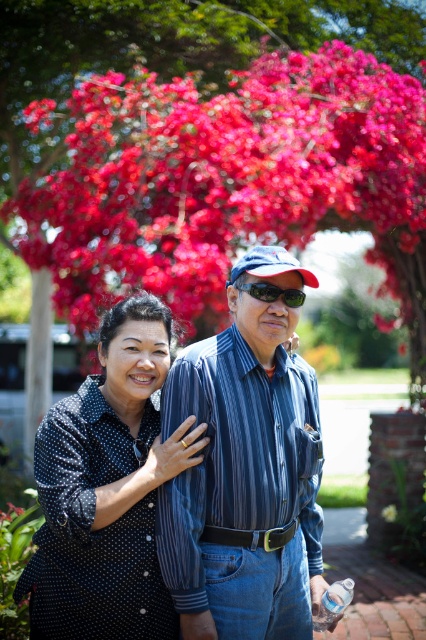
Based on the photo, you are standing in a garden and see the vibrant silk flowers at upper center. You want to take a photo of them with your phone, which has a maximum focus range of 5 meters. Can you take a clear photo without moving closer?

The vibrant silk flowers at upper center are 6.90 meters away from the viewer. Since your phone can only focus up to 5 meters, you cannot take a clear photo without moving closer.

You are standing at the position of point (259, 294) and want to walk towards the position of point (238, 596). Which direction should you move?

Since point (238, 596) is in front of point (259, 294), you should move forward to reach the desired position.